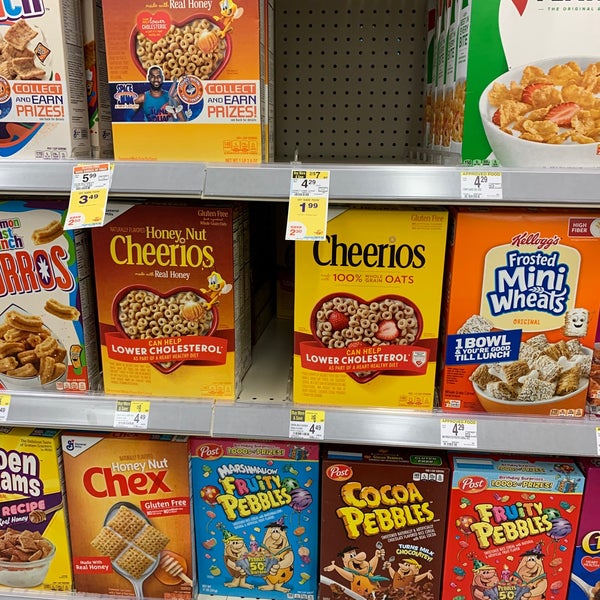
Identify the location of bottom shelf of cereal. (33, 528), (113, 528), (227, 528), (342, 526), (478, 526), (590, 541).